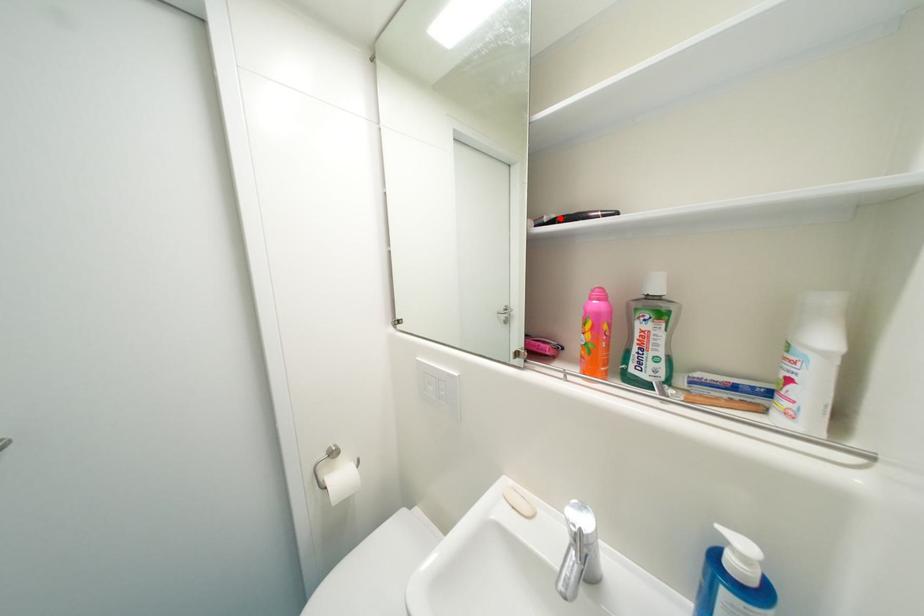
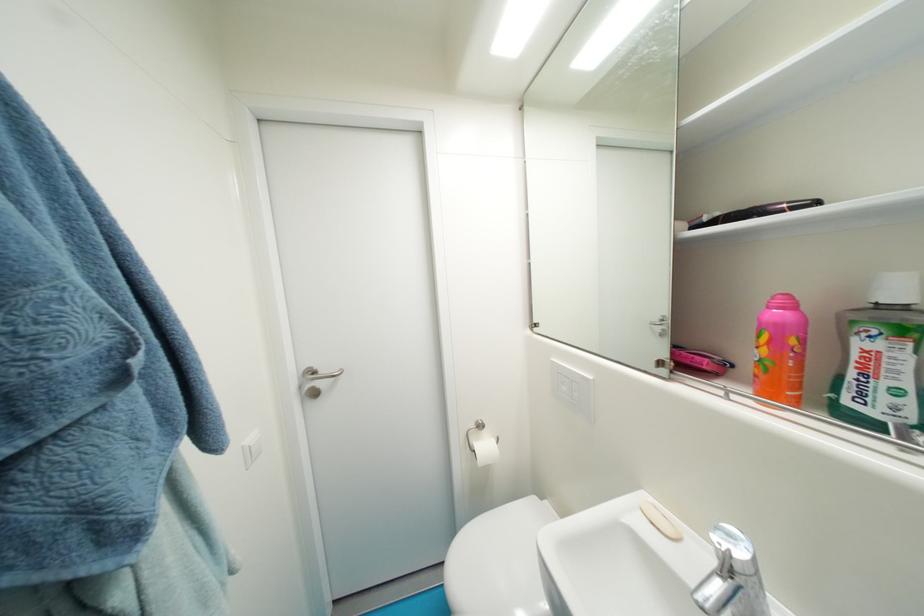
Locate, in the second image, the point that corresponds to the highlighted location in the first image.

(724, 216)